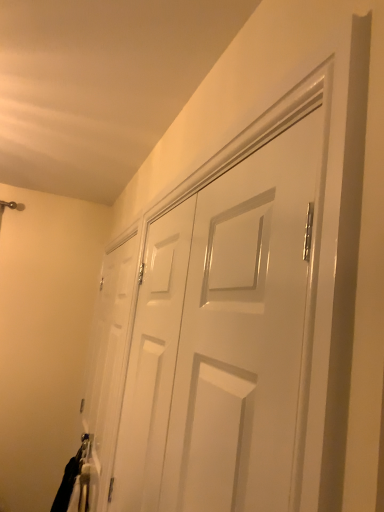
Question: Is white glossy door at center, arranged as the first door when viewed from the back, smaller than black fabric laundry at lower left?

Choices:
 (A) yes
 (B) no

Answer: (A)

Question: From a real-world perspective, is white glossy door at center, which is counted as the first door, starting from the left, below black fabric laundry at lower left?

Choices:
 (A) no
 (B) yes

Answer: (A)

Question: Is the position of white glossy door at center, which is counted as the first door, starting from the left, less distant than that of black fabric laundry at lower left?

Choices:
 (A) yes
 (B) no

Answer: (A)

Question: Is white glossy door at center, which is the 2th door from front to back, aimed at black fabric laundry at lower left?

Choices:
 (A) yes
 (B) no

Answer: (A)

Question: Does white glossy door at center, which is the 2th door from front to back, have a greater height compared to black fabric laundry at lower left?

Choices:
 (A) no
 (B) yes

Answer: (B)

Question: Is white glossy door at center, which is the 2th door from front to back, positioned beyond the bounds of black fabric laundry at lower left?

Choices:
 (A) yes
 (B) no

Answer: (A)

Question: Does white glossy door at center, which is the first door in front-to-back order, lie in front of white glossy door at center, which is the 2th door from front to back?

Choices:
 (A) no
 (B) yes

Answer: (B)

Question: Is white glossy door at center, the 2th door in the back-to-front sequence, shorter than white glossy door at center, arranged as the first door when viewed from the back?

Choices:
 (A) no
 (B) yes

Answer: (B)

Question: From the image's perspective, would you say white glossy door at center, the first door in the right-to-left sequence, is shown under white glossy door at center, the 2th door viewed from the right?

Choices:
 (A) yes
 (B) no

Answer: (B)

Question: Is white glossy door at center, which is the first door in front-to-back order, to the right of white glossy door at center, arranged as the first door when viewed from the back, from the viewer's perspective?

Choices:
 (A) no
 (B) yes

Answer: (B)

Question: Can you confirm if white glossy door at center, which is the first door in front-to-back order, is wider than white glossy door at center, which is the 2th door from front to back?

Choices:
 (A) no
 (B) yes

Answer: (B)

Question: Is white glossy door at center, which is counted as the first door, starting from the left, at the back of white glossy door at center, acting as the second door starting from the left?

Choices:
 (A) yes
 (B) no

Answer: (B)

Question: Can you confirm if black fabric laundry at lower left is wider than white glossy door at center, the 2th door viewed from the right?

Choices:
 (A) yes
 (B) no

Answer: (A)